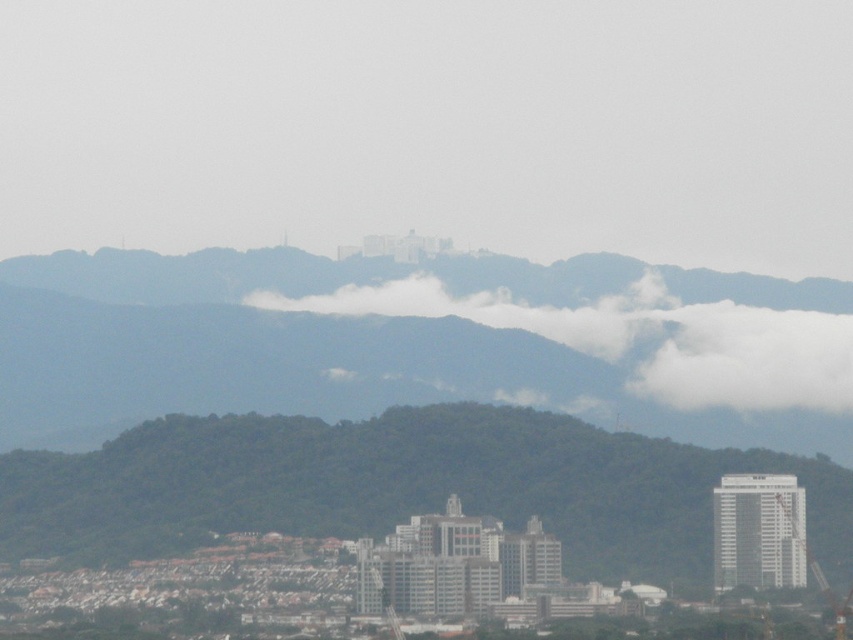
Between green leafy hill at center and white fluffy cloud at center, which one appears on the left side from the viewer's perspective?

green leafy hill at center

What do you see at coordinates (399, 486) in the screenshot? Image resolution: width=853 pixels, height=640 pixels. I see `green leafy hill at center` at bounding box center [399, 486].

Describe the element at coordinates (399, 486) in the screenshot. This screenshot has width=853, height=640. I see `green leafy hill at center` at that location.

Where is `green leafy hill at center`? This screenshot has height=640, width=853. green leafy hill at center is located at coordinates (399, 486).